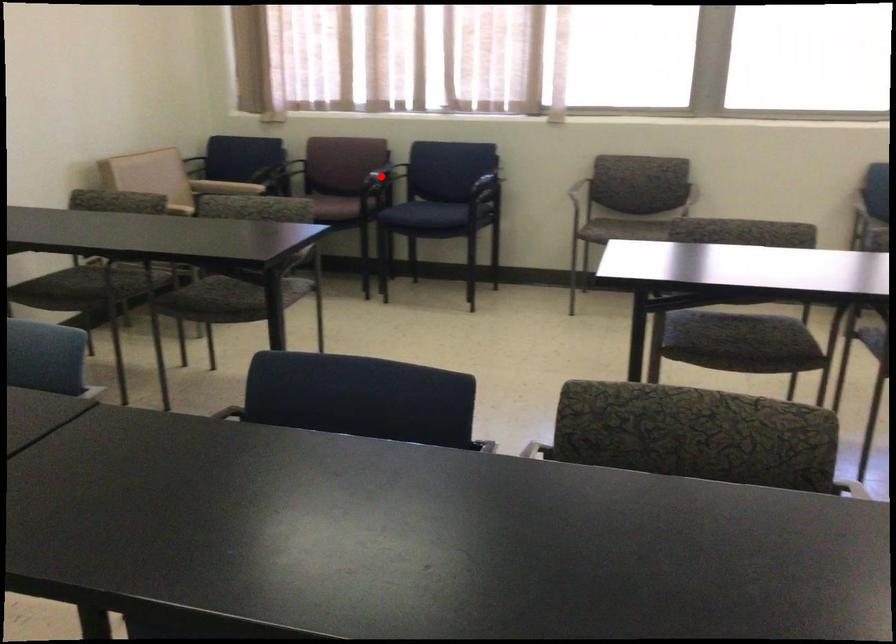
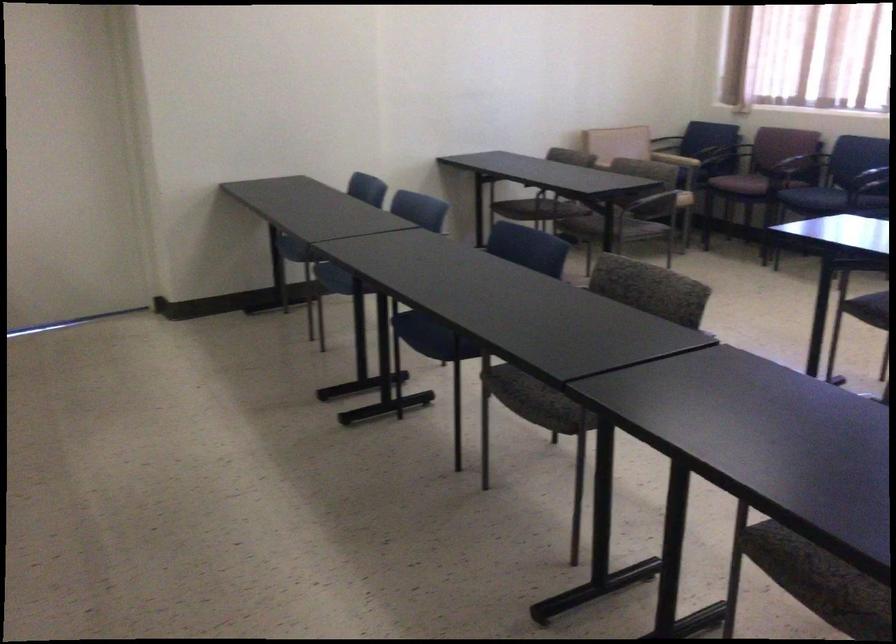
Question: I am providing you with two images of the same scene from different viewpoints. Given a red point in image1, look at the same physical point in image2. Is it:

Choices:
 (A) Closer to the viewpoint
 (B) Farther from the viewpoint

Answer: (B)